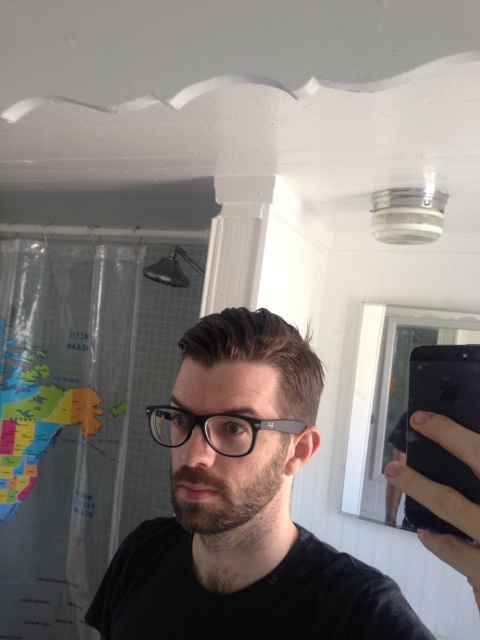
Question: Based on their relative distances, which object is nearer to the black matte smartphone at upper right?

Choices:
 (A) matte black glasses at center
 (B) black plastic glasses at center

Answer: (B)

Question: Does matte black glasses at center have a smaller size compared to black plastic glasses at center?

Choices:
 (A) no
 (B) yes

Answer: (A)

Question: Is matte black glasses at center in front of black matte smartphone at upper right?

Choices:
 (A) no
 (B) yes

Answer: (B)

Question: Which is farther from the matte black glasses at center?

Choices:
 (A) black plastic glasses at center
 (B) black matte smartphone at upper right

Answer: (B)

Question: Can you confirm if black matte smartphone at upper right is wider than black plastic glasses at center?

Choices:
 (A) yes
 (B) no

Answer: (B)

Question: Which point is farther from the camera taking this photo?

Choices:
 (A) (471, 401)
 (B) (159, 410)

Answer: (B)